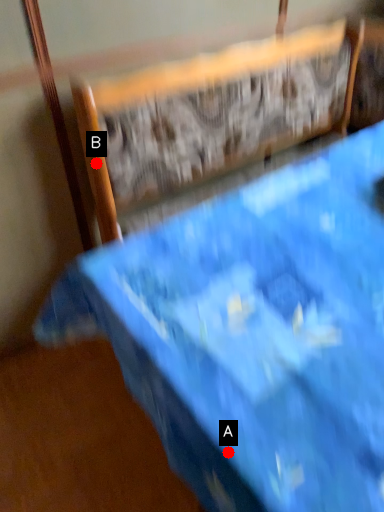
Question: Two points are circled on the image, labeled by A and B beside each circle. Which point is closer to the camera?

Choices:
 (A) A is closer
 (B) B is closer

Answer: (A)